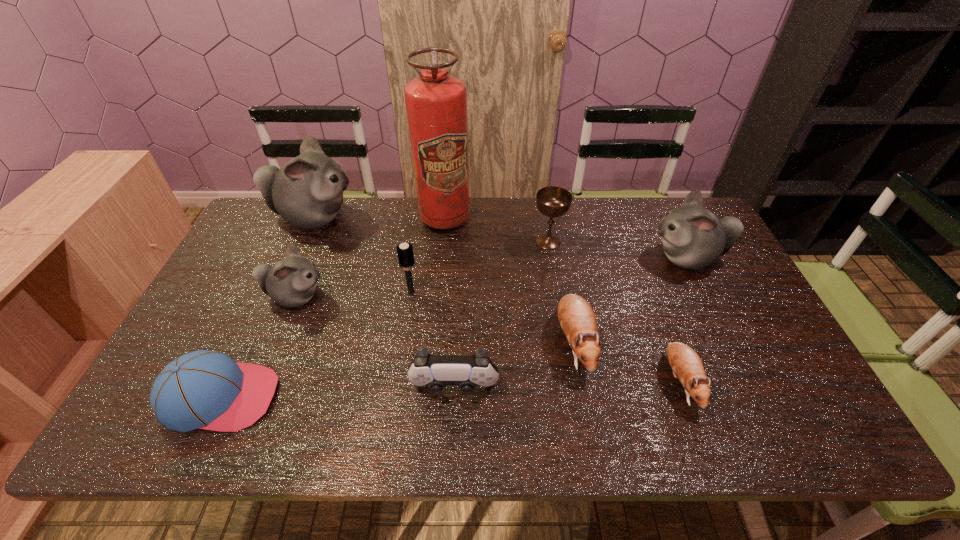
Find the location of a particular element. The image size is (960, 540). empty space between the third shortest hamster and the hairbrush is located at coordinates (353, 294).

Locate an element on the screen. The image size is (960, 540). vacant area that lies between the control and the hairbrush is located at coordinates (433, 341).

Find the location of a particular element. The width and height of the screenshot is (960, 540). the third closest object to the shortest hamster is located at coordinates (437, 371).

Find the location of a particular element. This screenshot has width=960, height=540. object that is the closest to the tallest object is located at coordinates (552, 201).

Identify which hamster is the fourth nearest to the hairbrush. Please provide its 2D coordinates. Your answer should be formatted as a tuple, i.e. [(x, y)], where the tuple contains the x and y coordinates of a point satisfying the conditions above.

[(686, 365)]

Select which hamster is the fourth closest to the left brown hamster. Please provide its 2D coordinates. Your answer should be formatted as a tuple, i.e. [(x, y)], where the tuple contains the x and y coordinates of a point satisfying the conditions above.

[(307, 192)]

Locate which white hamster is the third closest to the chalice. Please provide its 2D coordinates. Your answer should be formatted as a tuple, i.e. [(x, y)], where the tuple contains the x and y coordinates of a point satisfying the conditions above.

[(291, 282)]

This screenshot has height=540, width=960. In order to click on white hamster that can be found as the closest to the third tallest object in this screenshot , I will do `click(307, 192)`.

Find the location of a particular element. vacant region that satisfies the following two spatial constraints: 1. at the face of the second shortest hamster; 2. on the front-facing side of the blue baseball cap is located at coordinates click(x=584, y=397).

This screenshot has height=540, width=960. In order to click on free region that satisfies the following two spatial constraints: 1. on the label side of the red fire extinguisher; 2. on the front-facing side of the blue baseball cap in this screenshot , I will do `click(428, 397)`.